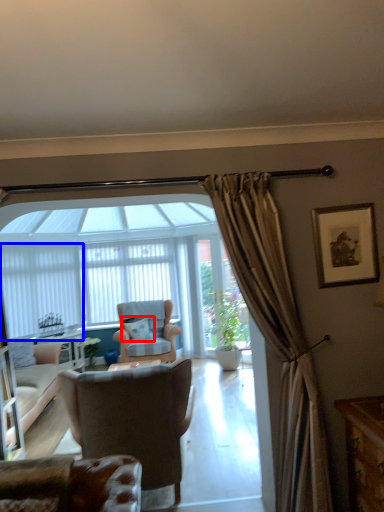
Question: Which point is further to the camera, pillow (highlighted by a red box) or curtain (highlighted by a blue box)?

Choices:
 (A) pillow
 (B) curtain

Answer: (A)